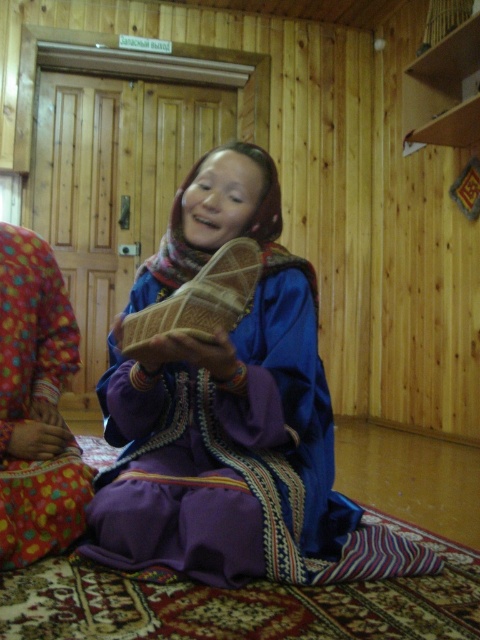
Which is more to the left, matte brown sandal at center or purple satin dress at center?

purple satin dress at center

Describe the element at coordinates (222, 406) in the screenshot. The width and height of the screenshot is (480, 640). I see `matte brown sandal at center` at that location.

Find the location of a particular element. matte brown sandal at center is located at coordinates (222, 406).